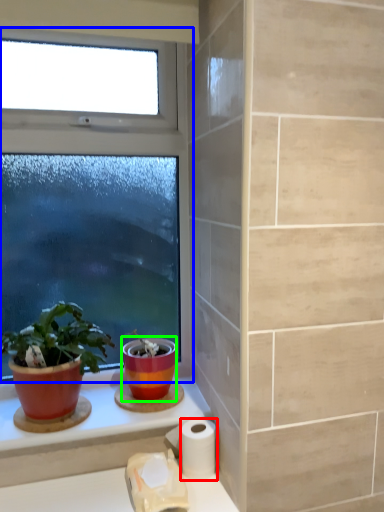
Question: Which object is positioned closest to toilet paper (highlighted by a red box)? Select from window (highlighted by a blue box) and flowerpot (highlighted by a green box).

Choices:
 (A) window
 (B) flowerpot

Answer: (B)